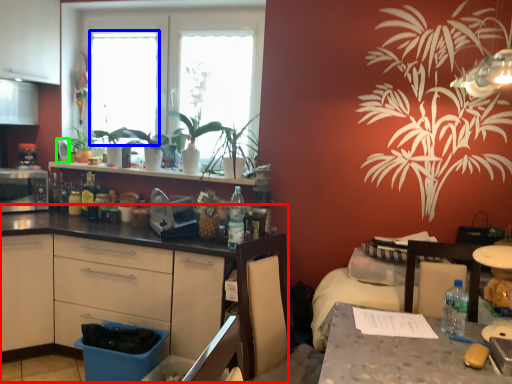
Question: Estimate the real-world distances between objects in this image. Which object is farther from countertop (highlighted by a red box), window screen (highlighted by a blue box) or appliance (highlighted by a green box)?

Choices:
 (A) window screen
 (B) appliance

Answer: (B)